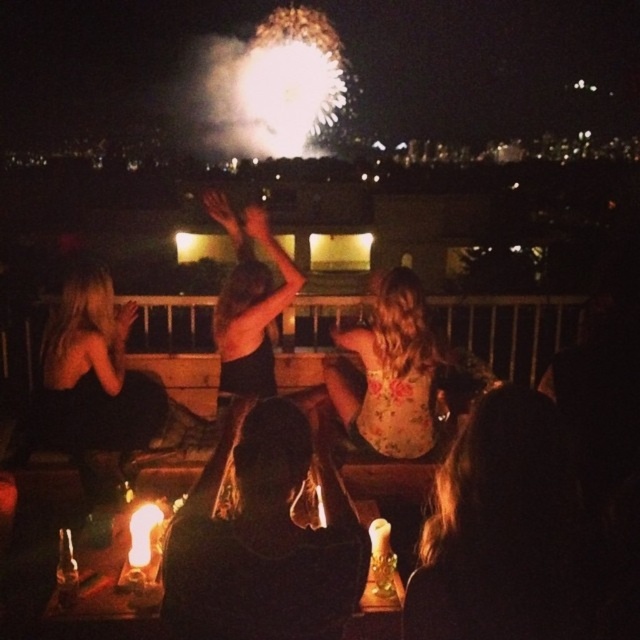
You are standing on the rooftop and looking at the two points in the scene, point (211, 193) and point (104, 564). Which point is closer to you?

Point (104, 564) is closer to you because it is less further to the camera than point (211, 193).